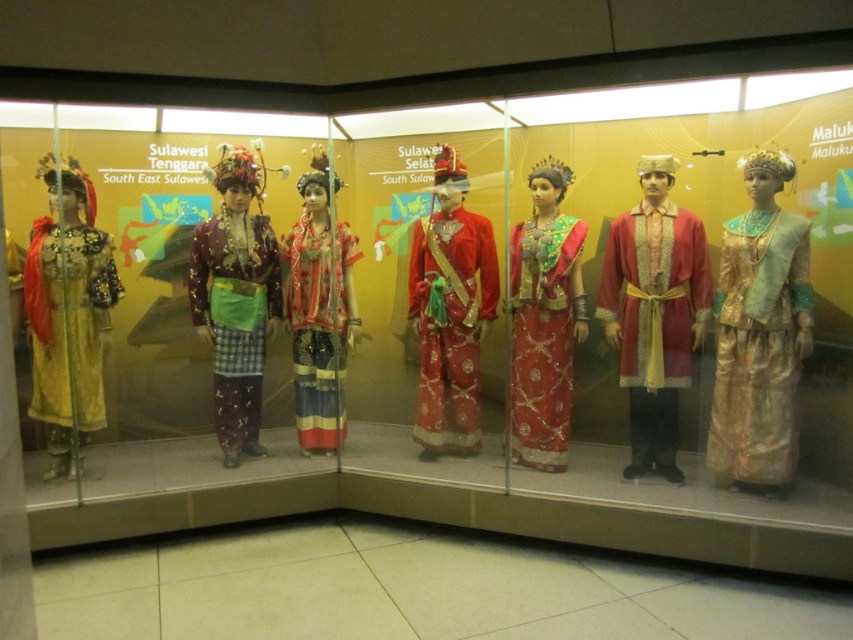
Does matte gold robe at center appear on the right side of shiny red fabric at center?

Yes, matte gold robe at center is to the right of shiny red fabric at center.

Locate an element on the screen. This screenshot has height=640, width=853. matte gold robe at center is located at coordinates [654, 321].

Is gold silk dress at right to the left of shiny silk dress at center from the viewer's perspective?

In fact, gold silk dress at right is to the right of shiny silk dress at center.

Is gold silk dress at right positioned in front of shiny silk dress at center?

That is True.

Between point (744, 316) and point (300, 424), which one is positioned in front?

Point (744, 316) is more forward.

At what (x,y) coordinates should I click in order to perform the action: click on gold silk dress at right. Please return your answer as a coordinate pair (x, y). Looking at the image, I should click on (759, 346).

Between shiny red fabric dress at center and shiny silk dress at center, which one has less height?

With less height is shiny red fabric dress at center.

Between point (531, 310) and point (312, 289), which one is positioned in front?

Point (531, 310) is in front.

Is point (567, 432) more distant than point (340, 289)?

No, (567, 432) is closer to viewer.

Locate an element on the screen. shiny red fabric dress at center is located at coordinates (543, 337).